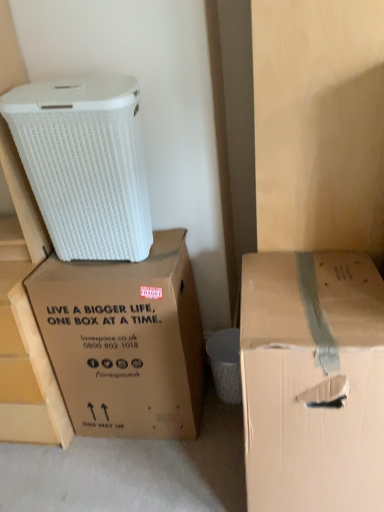
Question: Is white matte cardboard box at upper left to the right of brown cardboard box at right, positioned as the first box in right-to-left order, from the viewer's perspective?

Choices:
 (A) no
 (B) yes

Answer: (A)

Question: Would you say brown cardboard box at right, the second box positioned from the left, is part of white matte cardboard box at upper left's contents?

Choices:
 (A) yes
 (B) no

Answer: (B)

Question: Can you confirm if white matte cardboard box at upper left is wider than brown cardboard box at right, the second box positioned from the left?

Choices:
 (A) no
 (B) yes

Answer: (A)

Question: Can you confirm if white matte cardboard box at upper left is bigger than brown cardboard box at right, positioned as the first box in right-to-left order?

Choices:
 (A) yes
 (B) no

Answer: (B)

Question: From a real-world perspective, is white matte cardboard box at upper left over brown cardboard box at right, positioned as the first box in right-to-left order?

Choices:
 (A) yes
 (B) no

Answer: (A)

Question: Choose the correct answer: Is brown cardboard box at center, the 1th box positioned from the left, inside white matte cardboard box at upper left or outside it?

Choices:
 (A) inside
 (B) outside

Answer: (B)

Question: Is brown cardboard box at center, the 2th box viewed from the right, wider or thinner than white matte cardboard box at upper left?

Choices:
 (A) wide
 (B) thin

Answer: (A)

Question: Considering the positions of brown cardboard box at center, the 2th box viewed from the right, and white matte cardboard box at upper left in the image, is brown cardboard box at center, the 2th box viewed from the right, taller or shorter than white matte cardboard box at upper left?

Choices:
 (A) short
 (B) tall

Answer: (B)

Question: Is brown cardboard box at center, the 1th box positioned from the left, bigger or smaller than white matte cardboard box at upper left?

Choices:
 (A) big
 (B) small

Answer: (A)

Question: Is brown cardboard box at right, positioned as the first box in right-to-left order, to the left or to the right of white matte cardboard box at upper left in the image?

Choices:
 (A) left
 (B) right

Answer: (B)

Question: From the image's perspective, is brown cardboard box at right, the second box positioned from the left, positioned above or below white matte cardboard box at upper left?

Choices:
 (A) below
 (B) above

Answer: (A)

Question: Is brown cardboard box at right, positioned as the first box in right-to-left order, inside or outside of white matte cardboard box at upper left?

Choices:
 (A) inside
 (B) outside

Answer: (B)

Question: In terms of height, does brown cardboard box at right, positioned as the first box in right-to-left order, look taller or shorter compared to white matte cardboard box at upper left?

Choices:
 (A) tall
 (B) short

Answer: (A)

Question: In terms of size, does brown cardboard box at right, the second box positioned from the left, appear bigger or smaller than brown cardboard box at center, the 2th box viewed from the right?

Choices:
 (A) big
 (B) small

Answer: (A)

Question: Based on their positions, is brown cardboard box at right, the second box positioned from the left, located to the left or right of brown cardboard box at center, the 2th box viewed from the right?

Choices:
 (A) right
 (B) left

Answer: (A)